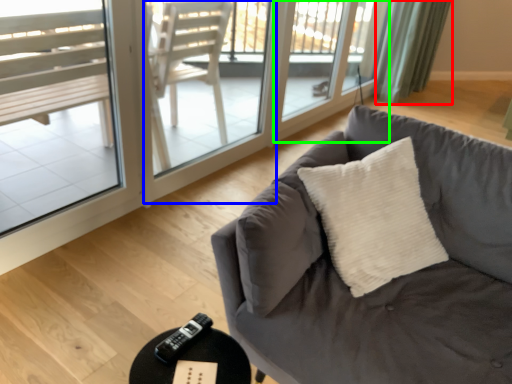
Question: Based on their relative distances, which object is nearer to curtain (highlighted by a red box)? Choose from screen door (highlighted by a blue box) and screen door (highlighted by a green box).

Choices:
 (A) screen door
 (B) screen door

Answer: (B)